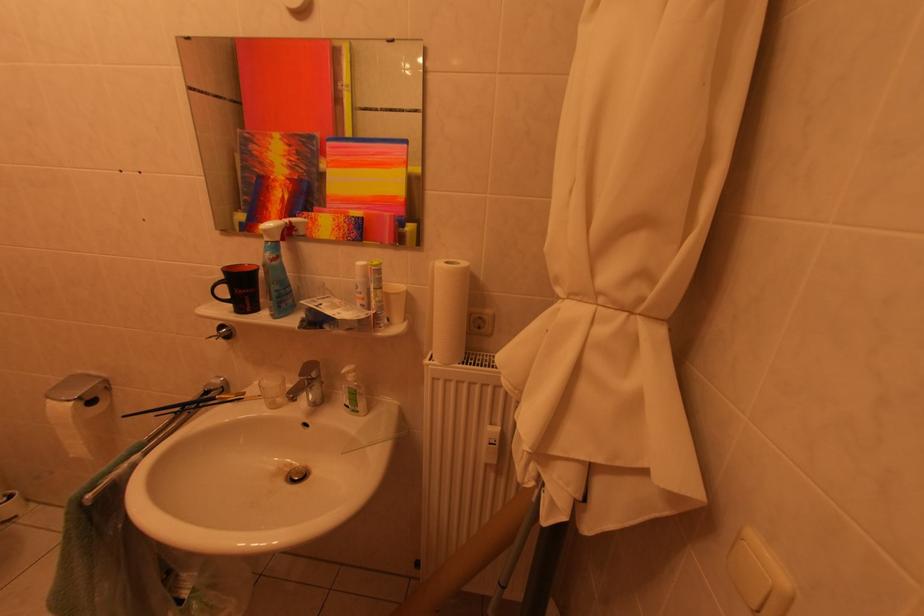
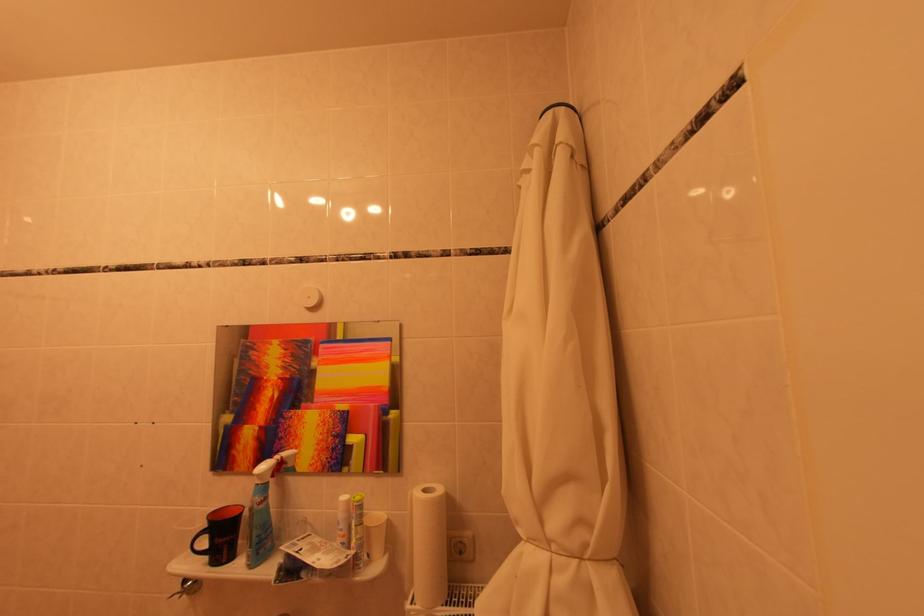
Find the pixel in the second image that matches point (380, 265) in the first image.

(362, 501)